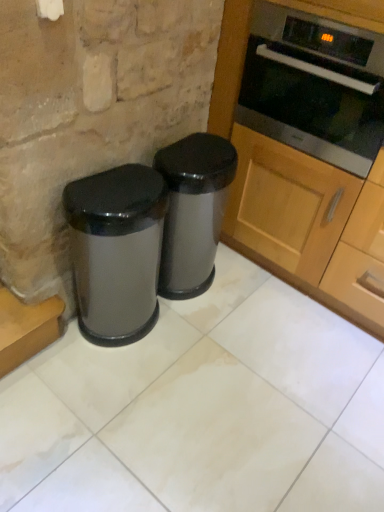
Question: Would you say wooden cabinet at right is part of glossy metallic trash can at lower left, which appears as the 2th waste container when viewed from the right,'s contents?

Choices:
 (A) no
 (B) yes

Answer: (A)

Question: Is glossy metallic trash can at lower left, which appears as the 2th waste container when viewed from the right, not near wooden cabinet at right?

Choices:
 (A) yes
 (B) no

Answer: (B)

Question: From the image's perspective, does glossy metallic trash can at lower left, which appears as the 2th waste container when viewed from the right, appear higher than wooden cabinet at right?

Choices:
 (A) no
 (B) yes

Answer: (A)

Question: Would you say glossy metallic trash can at lower left, which appears as the 2th waste container when viewed from the right, is outside wooden cabinet at right?

Choices:
 (A) no
 (B) yes

Answer: (B)

Question: Is glossy metallic trash can at lower left, which appears as the 2th waste container when viewed from the right, aimed at wooden cabinet at right?

Choices:
 (A) yes
 (B) no

Answer: (B)

Question: In terms of height, does wooden cabinet at right look taller or shorter compared to glossy metallic trash can at lower left, which appears as the 2th waste container when viewed from the right?

Choices:
 (A) tall
 (B) short

Answer: (A)

Question: Based on their positions, is wooden cabinet at right located to the left or right of glossy metallic trash can at lower left, marked as the first waste container in a left-to-right arrangement?

Choices:
 (A) right
 (B) left

Answer: (A)

Question: Is wooden cabinet at right wider or thinner than glossy metallic trash can at lower left, marked as the first waste container in a left-to-right arrangement?

Choices:
 (A) thin
 (B) wide

Answer: (B)

Question: Would you say wooden cabinet at right is inside or outside glossy metallic trash can at lower left, marked as the first waste container in a left-to-right arrangement?

Choices:
 (A) outside
 (B) inside

Answer: (A)

Question: Is stainless steel oven at upper right in front of or behind glossy metallic trash can at lower left, which appears as the 2th waste container when viewed from the right, in the image?

Choices:
 (A) front
 (B) behind

Answer: (B)

Question: Is point (299, 92) positioned closer to the camera than point (160, 241)?

Choices:
 (A) farther
 (B) closer

Answer: (B)

Question: Is stainless steel oven at upper right bigger or smaller than glossy metallic trash can at lower left, which appears as the 2th waste container when viewed from the right?

Choices:
 (A) small
 (B) big

Answer: (B)

Question: From the image's perspective, is stainless steel oven at upper right positioned above or below glossy metallic trash can at lower left, which appears as the 2th waste container when viewed from the right?

Choices:
 (A) above
 (B) below

Answer: (A)

Question: Is satin silver trash can at center, which is the first waste container in right-to-left order, taller or shorter than glossy metallic trash can at lower left, which appears as the 2th waste container when viewed from the right?

Choices:
 (A) tall
 (B) short

Answer: (A)

Question: From a real-world perspective, is satin silver trash can at center, the second waste container viewed from the left, above or below glossy metallic trash can at lower left, marked as the first waste container in a left-to-right arrangement?

Choices:
 (A) above
 (B) below

Answer: (A)